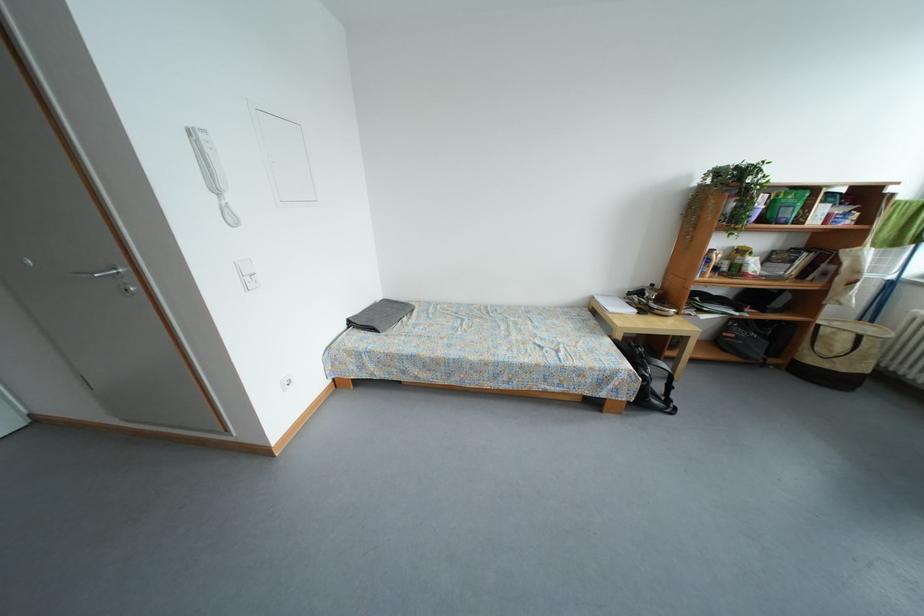
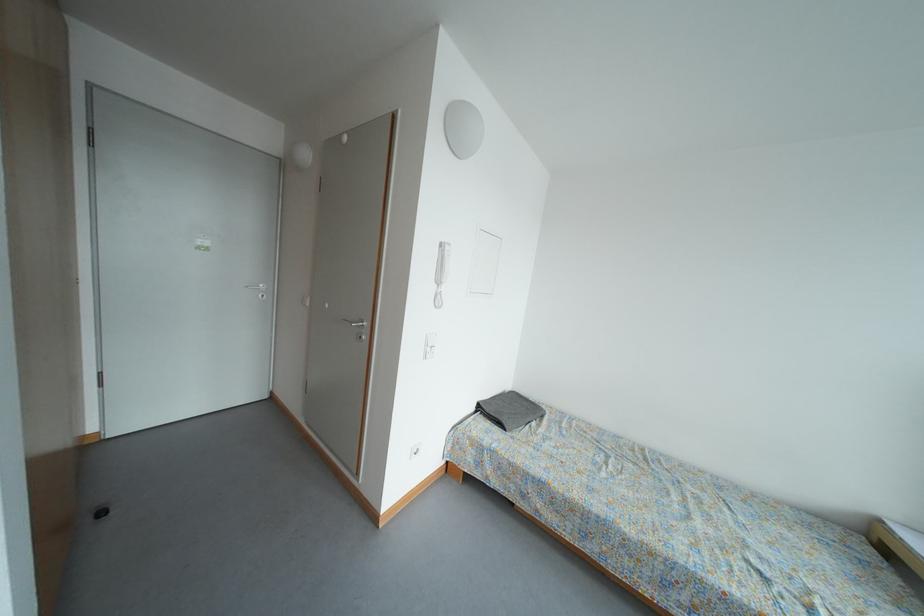
Find the pixel in the second image that matches pixel 357 328 in the first image.

(485, 411)